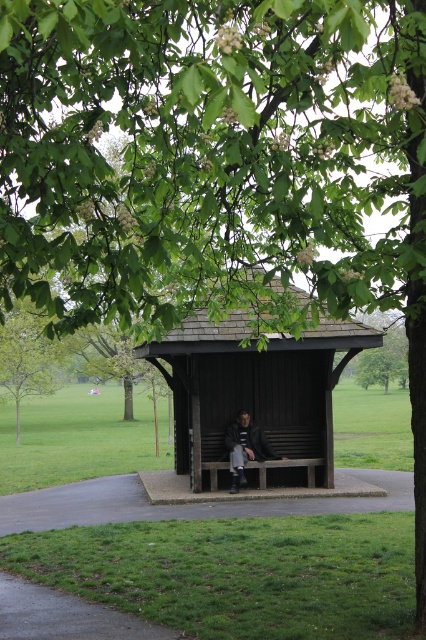
Question: Which object is positioned closest to the wooden bench at center?

Choices:
 (A) brown wooden bench at center
 (B) green leafy tree at lower left

Answer: (A)

Question: Is green leafy tree at lower left thinner than wooden bench at center?

Choices:
 (A) no
 (B) yes

Answer: (A)

Question: Considering the relative positions of green leafy tree at lower left and wooden bench at center in the image provided, where is green leafy tree at lower left located with respect to wooden bench at center?

Choices:
 (A) below
 (B) above

Answer: (B)

Question: Is brown wooden bench at center thinner than dark gray leather jacket at center?

Choices:
 (A) yes
 (B) no

Answer: (B)

Question: Which point is closer to the camera taking this photo?

Choices:
 (A) (242, 422)
 (B) (302, 436)

Answer: (A)

Question: Which point is closer to the camera?

Choices:
 (A) (226, 440)
 (B) (305, 394)
 (C) (261, 465)

Answer: (C)